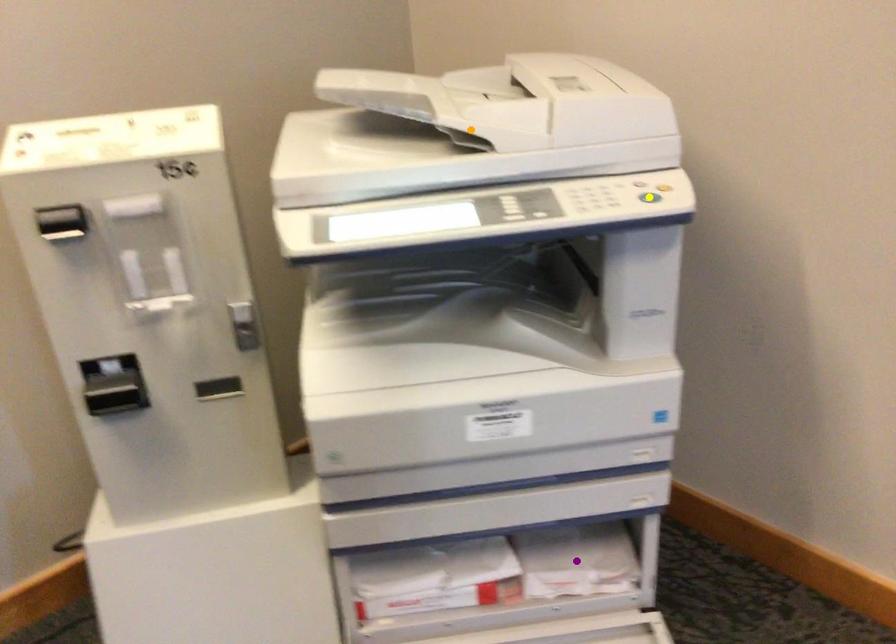
Order these from nearest to farthest:
1. orange point
2. yellow point
3. purple point

yellow point
orange point
purple point